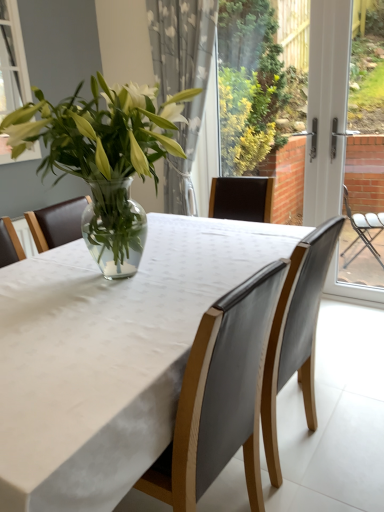
In order to click on matte gray chair at center, the 1th chair when ordered from left to right in this screenshot , I will do `click(220, 396)`.

Considering the relative sizes of leather chair at center, the 1th chair in the right-to-left sequence, and white sheer curtain at upper center in the image provided, is leather chair at center, the 1th chair in the right-to-left sequence, wider than white sheer curtain at upper center?

Indeed, leather chair at center, the 1th chair in the right-to-left sequence, has a greater width compared to white sheer curtain at upper center.

Does leather chair at center, the second chair viewed from the left, come behind white sheer curtain at upper center?

No, it is not.

Can you confirm if leather chair at center, the second chair viewed from the left, is bigger than white sheer curtain at upper center?

Actually, leather chair at center, the second chair viewed from the left, might be smaller than white sheer curtain at upper center.

Is leather chair at center, the 1th chair in the right-to-left sequence, inside or outside of white sheer curtain at upper center?

leather chair at center, the 1th chair in the right-to-left sequence, lies outside white sheer curtain at upper center.

Is white sheer curtain at upper center taller or shorter than leather chair at center, the 1th chair in the right-to-left sequence?

In the image, white sheer curtain at upper center appears to be taller than leather chair at center, the 1th chair in the right-to-left sequence.

Between white sheer curtain at upper center and leather chair at center, the 1th chair in the right-to-left sequence, which one is positioned behind?

Positioned behind is white sheer curtain at upper center.

From a real-world perspective, starting from the white sheer curtain at upper center, which chair is the 2nd one below it? Please provide its 2D coordinates.

[(296, 333)]

Does white sheer curtain at upper center have a lesser width compared to leather chair at center, the 1th chair in the right-to-left sequence?

Indeed, white sheer curtain at upper center has a lesser width compared to leather chair at center, the 1th chair in the right-to-left sequence.

From the image's perspective, which is below, white sheer curtain at upper center or matte gray chair at center, the second chair from the right?

From the image's view, matte gray chair at center, the second chair from the right, is below.

Is matte gray chair at center, the second chair from the right, surrounded by white sheer curtain at upper center?

No, matte gray chair at center, the second chair from the right, is not inside white sheer curtain at upper center.

Who is taller, white sheer curtain at upper center or matte gray chair at center, the 1th chair when ordered from left to right?

white sheer curtain at upper center.

Can you confirm if white sheer curtain at upper center is thinner than matte gray chair at center, the 1th chair when ordered from left to right?

Yes.

Does point (201, 73) appear closer or farther from the camera than point (118, 394)?

Point (201, 73) is positioned farther from the camera compared to point (118, 394).

Choose the correct answer: Is white sheer curtain at upper center inside white fabric table at center or outside it?

white sheer curtain at upper center is not enclosed by white fabric table at center.

Between white sheer curtain at upper center and white fabric table at center, which one has smaller width?

white sheer curtain at upper center is thinner.

Is the depth of white sheer curtain at upper center greater than that of white fabric table at center?

Yes, white sheer curtain at upper center is further from the viewer.

From the image's perspective, is white fabric table at center above or below white plastic screen door at right?

From the image's perspective, white fabric table at center appears below white plastic screen door at right.

Does white fabric table at center appear on the left side of white plastic screen door at right?

Correct, you'll find white fabric table at center to the left of white plastic screen door at right.

Consider the image. Is white fabric table at center not within white plastic screen door at right?

Yes, white fabric table at center is outside of white plastic screen door at right.

Which is closer, (52, 366) or (327, 21)?

Point (52, 366) appears to be closer to the viewer than point (327, 21).

Is white plastic screen door at right facing towards leather chair at center, the second chair viewed from the left?

Yes, white plastic screen door at right is oriented towards leather chair at center, the second chair viewed from the left.

Between white plastic screen door at right and leather chair at center, the second chair viewed from the left, which one has more height?

Standing taller between the two is white plastic screen door at right.

Considering the positions of objects white plastic screen door at right and leather chair at center, the 1th chair in the right-to-left sequence, in the image provided, who is in front, white plastic screen door at right or leather chair at center, the 1th chair in the right-to-left sequence,?

leather chair at center, the 1th chair in the right-to-left sequence, is in front.

Is leather chair at center, the 1th chair in the right-to-left sequence, located within white plastic screen door at right?

No.

Measure the distance between matte gray chair at center, the 1th chair when ordered from left to right, and white plastic screen door at right.

matte gray chair at center, the 1th chair when ordered from left to right, and white plastic screen door at right are 5.97 feet apart from each other.

Is white plastic screen door at right located within matte gray chair at center, the second chair from the right?

No, matte gray chair at center, the second chair from the right, does not contain white plastic screen door at right.

Does matte gray chair at center, the 1th chair when ordered from left to right, have a lesser height compared to white plastic screen door at right?

Indeed, matte gray chair at center, the 1th chair when ordered from left to right, has a lesser height compared to white plastic screen door at right.

In the scene shown: How many degrees apart are the facing directions of matte gray chair at center, the second chair from the right, and white plastic screen door at right?

92.7 degrees separate the facing orientations of matte gray chair at center, the second chair from the right, and white plastic screen door at right.

Find the location of a particular element. The height and width of the screenshot is (512, 384). curtain above the leather chair at center, the second chair viewed from the left (from the image's perspective) is located at coordinates (182, 81).

Where is `curtain that is above the leather chair at center, the second chair viewed from the left (from a real-world perspective)`? This screenshot has width=384, height=512. curtain that is above the leather chair at center, the second chair viewed from the left (from a real-world perspective) is located at coordinates (182, 81).

Which object lies further to the anchor point leather chair at center, the 1th chair in the right-to-left sequence, matte gray chair at center, the second chair from the right, or white fabric table at center?

white fabric table at center lies further to leather chair at center, the 1th chair in the right-to-left sequence, than the other object.

Based on their spatial positions, is white plastic screen door at right or matte gray chair at center, the second chair from the right, further from leather chair at center, the second chair viewed from the left?

The object further to leather chair at center, the second chair viewed from the left, is white plastic screen door at right.

From the image, which object appears to be nearer to white sheer curtain at upper center, white plastic screen door at right or matte gray chair at center, the second chair from the right?

The object closer to white sheer curtain at upper center is white plastic screen door at right.

Which object lies further to the anchor point leather chair at center, the 1th chair in the right-to-left sequence, white plastic screen door at right or white fabric table at center?

white plastic screen door at right is further to leather chair at center, the 1th chair in the right-to-left sequence.

From the image, which object appears to be farther from white plastic screen door at right, matte gray chair at center, the 1th chair when ordered from left to right, or white sheer curtain at upper center?

matte gray chair at center, the 1th chair when ordered from left to right.

Looking at this image, from the image, which object appears to be nearer to leather chair at center, the second chair viewed from the left, matte gray chair at center, the 1th chair when ordered from left to right, or white plastic screen door at right?

matte gray chair at center, the 1th chair when ordered from left to right, lies closer to leather chair at center, the second chair viewed from the left, than the other object.

Considering their positions, is matte gray chair at center, the 1th chair when ordered from left to right, positioned further to white fabric table at center than leather chair at center, the 1th chair in the right-to-left sequence?

leather chair at center, the 1th chair in the right-to-left sequence.

Considering their positions, is white plastic screen door at right positioned closer to leather chair at center, the second chair viewed from the left, than white sheer curtain at upper center?

white plastic screen door at right is positioned closer to the anchor leather chair at center, the second chair viewed from the left.

The width and height of the screenshot is (384, 512). I want to click on chair between matte gray chair at center, the 1th chair when ordered from left to right, and white sheer curtain at upper center, along the z-axis, so click(296, 333).

In order to click on screen door between white sheer curtain at upper center and leather chair at center, the 1th chair in the right-to-left sequence, in the vertical direction in this screenshot , I will do `click(327, 106)`.

Locate an element on the screen. The image size is (384, 512). screen door between matte gray chair at center, the 1th chair when ordered from left to right, and white sheer curtain at upper center in the front-back direction is located at coordinates (327, 106).

You are a GUI agent. You are given a task and a screenshot of the screen. Output one action in this format:
    pyautogui.click(x=<x>, y=<y>)
    Task: Click on the screen door between white fabric table at center and white sheer curtain at upper center from front to back
    
    Given the screenshot: What is the action you would take?
    click(327, 106)